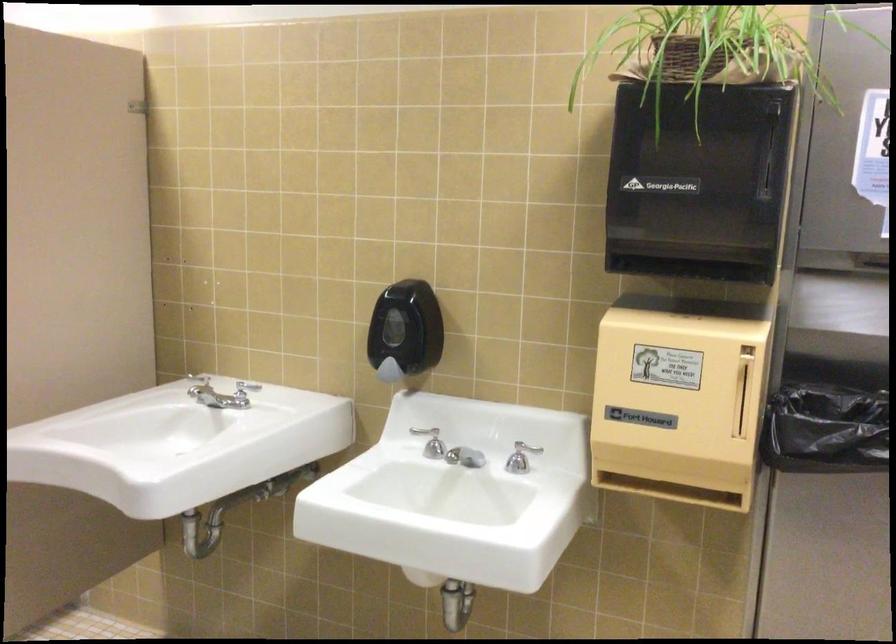
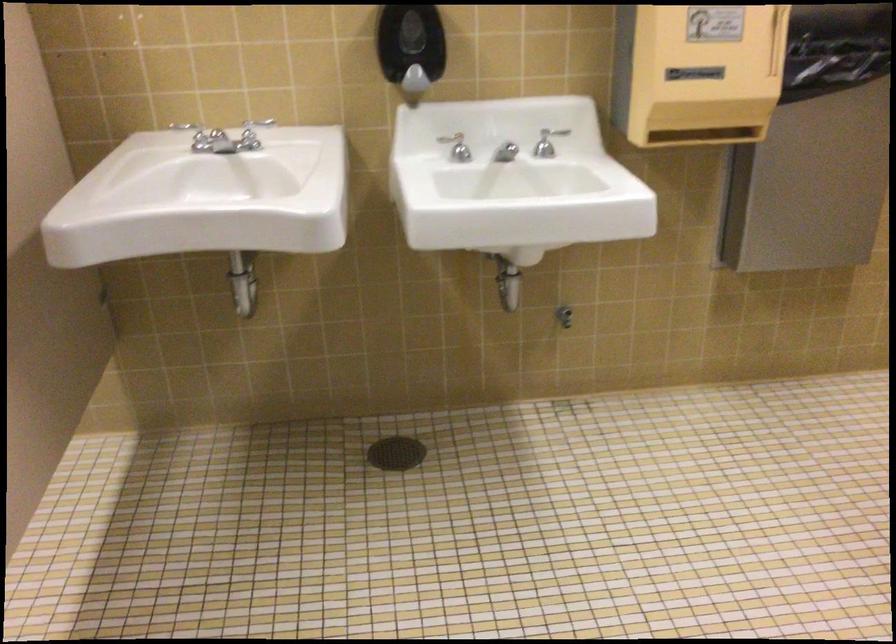
Where in the second image is the point corresponding to [384,375] from the first image?

(412, 84)